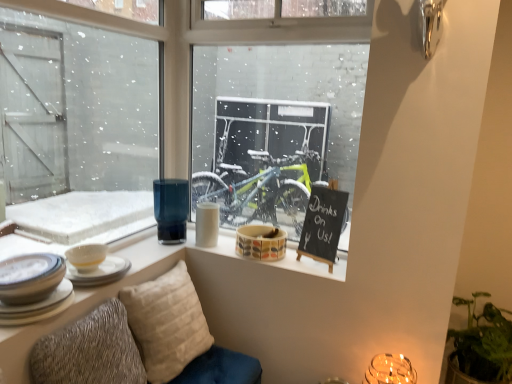
The height and width of the screenshot is (384, 512). Identify the location of blank space situated above multicolored ceramic mug at center, the 7th tableware in the left-to-right sequence (from a real-world perspective). (259, 228).